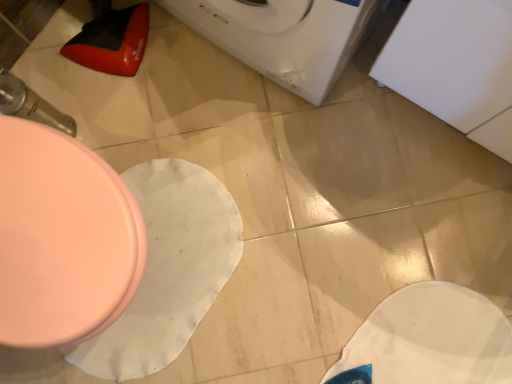
The height and width of the screenshot is (384, 512). I want to click on white glossy washing machine at upper center, so click(283, 36).

Describe the element at coordinates (283, 36) in the screenshot. The image size is (512, 384). I see `white glossy washing machine at upper center` at that location.

Describe the element at coordinates (62, 238) in the screenshot. I see `matte pink toilet at left` at that location.

Where is `matte pink toilet at left`? The width and height of the screenshot is (512, 384). matte pink toilet at left is located at coordinates (62, 238).

What are the coordinates of `white glossy washing machine at upper center` in the screenshot? It's located at (283, 36).

Which is more to the right, matte pink toilet at left or white glossy washing machine at upper center?

From the viewer's perspective, white glossy washing machine at upper center appears more on the right side.

Which object is closer to the camera taking this photo, matte pink toilet at left or white glossy washing machine at upper center?

white glossy washing machine at upper center is in front.

Considering the positions of points (0, 328) and (306, 38), is point (0, 328) closer to camera compared to point (306, 38)?

Yes.

From the image's perspective, would you say matte pink toilet at left is positioned over white glossy washing machine at upper center?

Incorrect, from the image's perspective, matte pink toilet at left is lower than white glossy washing machine at upper center.

From a real-world perspective, is matte pink toilet at left positioned over white glossy washing machine at upper center based on gravity?

No, from a real-world perspective, matte pink toilet at left is not on top of white glossy washing machine at upper center.

Which object is wider, matte pink toilet at left or white glossy washing machine at upper center?

matte pink toilet at left.

Based on the photo, considering the sizes of matte pink toilet at left and white glossy washing machine at upper center in the image, is matte pink toilet at left taller or shorter than white glossy washing machine at upper center?

Considering their sizes, matte pink toilet at left has less height than white glossy washing machine at upper center.

Considering the sizes of objects matte pink toilet at left and white glossy washing machine at upper center in the image provided, who is smaller, matte pink toilet at left or white glossy washing machine at upper center?

matte pink toilet at left.

Is white glossy washing machine at upper center located within matte pink toilet at left?

No, matte pink toilet at left does not contain white glossy washing machine at upper center.

Would you consider matte pink toilet at left to be distant from white glossy washing machine at upper center?

No, matte pink toilet at left is in close proximity to white glossy washing machine at upper center.

Is matte pink toilet at left turned away from white glossy washing machine at upper center?

That's not correct — matte pink toilet at left is not looking away from white glossy washing machine at upper center.

Find the location of a particular element. The height and width of the screenshot is (384, 512). washing machine above the matte pink toilet at left (from a real-world perspective) is located at coordinates (283, 36).

Which is more to the right, white glossy washing machine at upper center or matte pink toilet at left?

white glossy washing machine at upper center.

Based on the photo, considering the positions of objects white glossy washing machine at upper center and matte pink toilet at left in the image provided, who is behind, white glossy washing machine at upper center or matte pink toilet at left?

matte pink toilet at left is further away from the camera.

Which point is more distant from viewer, (261,62) or (46,280)?

The point (261,62) is farther.

From the image's perspective, would you say white glossy washing machine at upper center is shown under matte pink toilet at left?

No, from the image's perspective, white glossy washing machine at upper center is not beneath matte pink toilet at left.

In the scene shown: From a real-world perspective, is white glossy washing machine at upper center above or below matte pink toilet at left?

white glossy washing machine at upper center is situated higher than matte pink toilet at left in the real world.

Does white glossy washing machine at upper center have a greater width compared to matte pink toilet at left?

No, white glossy washing machine at upper center is not wider than matte pink toilet at left.

Who is taller, white glossy washing machine at upper center or matte pink toilet at left?

Standing taller between the two is white glossy washing machine at upper center.

Based on their sizes in the image, would you say white glossy washing machine at upper center is bigger or smaller than matte pink toilet at left?

white glossy washing machine at upper center is bigger than matte pink toilet at left.

Is white glossy washing machine at upper center surrounding matte pink toilet at left?

No, matte pink toilet at left is located outside of white glossy washing machine at upper center.

Is white glossy washing machine at upper center in contact with matte pink toilet at left?

white glossy washing machine at upper center is not next to matte pink toilet at left, and they're not touching.

Could you tell me if white glossy washing machine at upper center is facing matte pink toilet at left?

Yes, white glossy washing machine at upper center is facing matte pink toilet at left.

The image size is (512, 384). I want to click on toilet that appears behind the white glossy washing machine at upper center, so click(x=62, y=238).

The width and height of the screenshot is (512, 384). I want to click on toilet below the white glossy washing machine at upper center (from a real-world perspective), so click(x=62, y=238).

The height and width of the screenshot is (384, 512). Identify the location of toilet behind the white glossy washing machine at upper center. (62, 238).